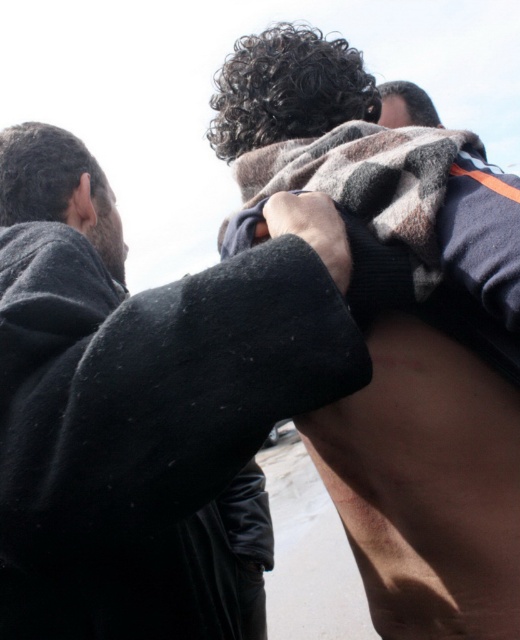
You are trying to decide which item to take for warmth between the dark gray wool sweater at upper center and the fuzzy wool blanket at upper center. Based on their sizes, which one might be more suitable for covering a larger area?

The dark gray wool sweater at upper center has a larger width than the fuzzy wool blanket at upper center, so it might be more suitable for covering a larger area.

You are trying to decide whether to take the dark gray wool sweater at upper center or the fuzzy wool blanket at upper center with you on a hike. Based on their positions in the image, which item is more accessible to reach?

The dark gray wool sweater at upper center is in front of the fuzzy wool blanket at upper center, so it is more accessible to reach.

You are a tailor measuring the distance between two items in the image. The dark gray wool sweater at upper center and the fuzzy wool blanket at upper center are both on a mannequin. Can you fit a 12 inch ruler between them without bending it?

The dark gray wool sweater at upper center and fuzzy wool blanket at upper center are 14.07 inches apart from each other, so yes, a 12 inch ruler can fit between them without bending it since the distance is greater than the ruler length.